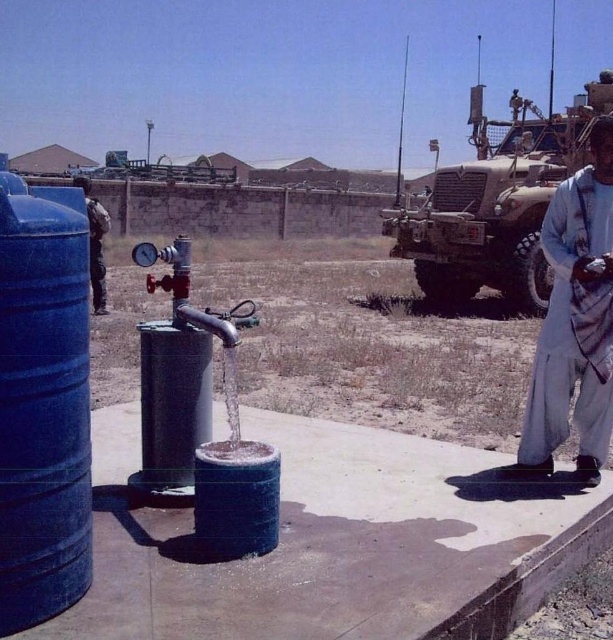
Looking at this image, you are a photographer planning to take a photo of the camouflage fabric military vehicle at upper right and the dark blue fabric jacket at left. Which object should you focus on first if you want to capture both in the frame without moving the camera?

The camouflage fabric military vehicle at upper right is larger in size than the dark blue fabric jacket at left, so you should focus on the camouflage fabric military vehicle at upper right first to ensure it fits properly in the frame.

You are a delivery driver who needs to park your truck next to the blue matte barrel at left and the camouflage fabric military vehicle at upper right. Which one requires more space in width to park next to?

The camouflage fabric military vehicle at upper right requires more space in width because it is wider than the blue matte barrel at left.

You are a photographer standing on the platform where the water distribution system is located. You want to take a photo of the camouflage fabric military vehicle at upper right and the dark blue fabric jacket at left. Which object should you focus on first to ensure both are in the frame?

You should focus on the camouflage fabric military vehicle at upper right first because it is closer to you than the dark blue fabric jacket at left, so adjusting the focus starting from the closer object ensures both are in the frame.